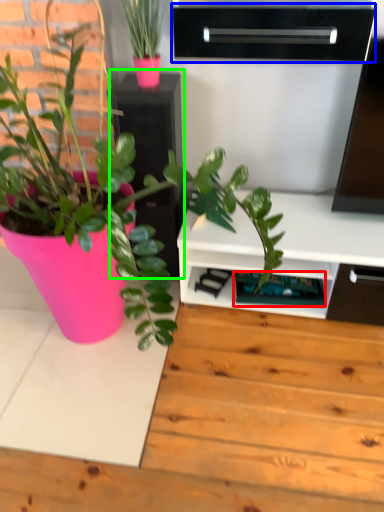
Question: Considering the real-world distances, which object is closest to shelf (highlighted by a red box)? shelf (highlighted by a blue box) or file cabinet (highlighted by a green box).

Choices:
 (A) shelf
 (B) file cabinet

Answer: (B)